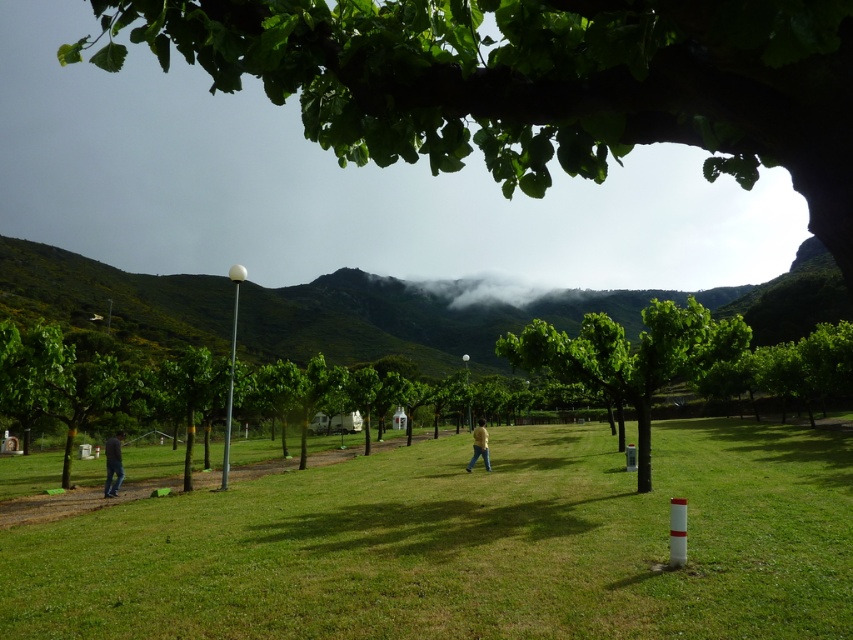
Consider the image. Does green leafy tree at upper center lie behind green leafy tree at center?

No, green leafy tree at upper center is in front of green leafy tree at center.

Does green leafy tree at upper center have a lesser height compared to green leafy tree at center?

Incorrect, green leafy tree at upper center's height does not fall short of green leafy tree at center's.

What do you see at coordinates (537, 81) in the screenshot?
I see `green leafy tree at upper center` at bounding box center [537, 81].

This screenshot has width=853, height=640. Find the location of `green leafy tree at upper center`. green leafy tree at upper center is located at coordinates (537, 81).

Is dark blue jeans at lower left further to the viewer compared to yellow matte shirt at center?

No, it is not.

The height and width of the screenshot is (640, 853). Describe the element at coordinates (113, 465) in the screenshot. I see `dark blue jeans at lower left` at that location.

Where is `dark blue jeans at lower left`? Image resolution: width=853 pixels, height=640 pixels. dark blue jeans at lower left is located at coordinates (113, 465).

This screenshot has height=640, width=853. What are the coordinates of `dark blue jeans at lower left` in the screenshot? It's located at (113, 465).

Between green grassy field at center and white fluffy cloud at center, which one appears on the left side from the viewer's perspective?

green grassy field at center

Which is more to the right, green grassy field at center or white fluffy cloud at center?

From the viewer's perspective, white fluffy cloud at center appears more on the right side.

This screenshot has height=640, width=853. What are the coordinates of `green grassy field at center` in the screenshot? It's located at (466, 545).

Identify the location of green grassy field at center. This screenshot has height=640, width=853. (466, 545).